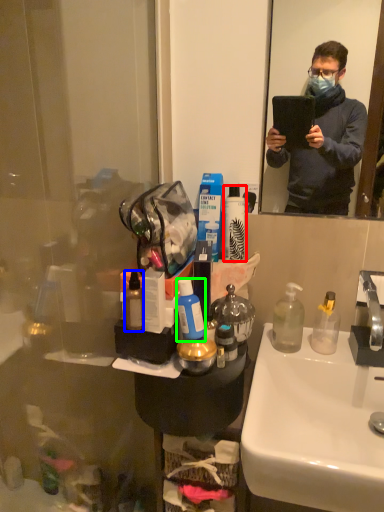
Question: Based on their relative distances, which object is farther from toiletry (highlighted by a red box)? Choose from toiletries (highlighted by a blue box) and toiletries (highlighted by a green box).

Choices:
 (A) toiletries
 (B) toiletries

Answer: (A)